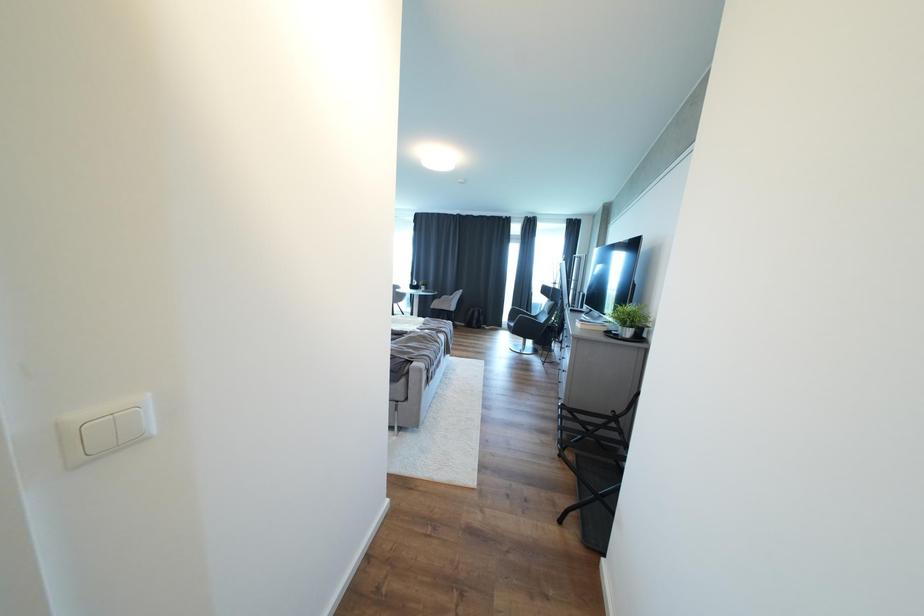
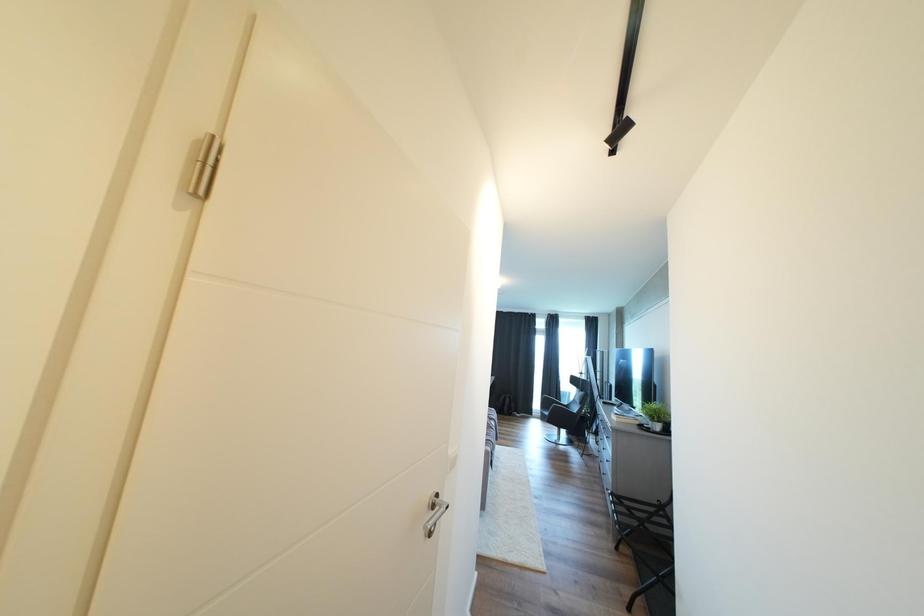
What movement of the cameraman would produce the second image?

The movement direction of the cameraman is left, backward.